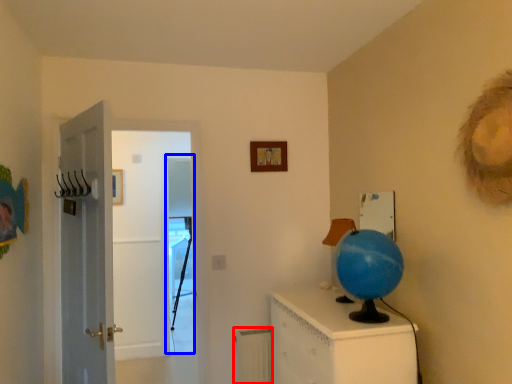
Question: Which point is closer to the camera, radiator (highlighted by a red box) or screen door (highlighted by a blue box)?

Choices:
 (A) radiator
 (B) screen door

Answer: (A)